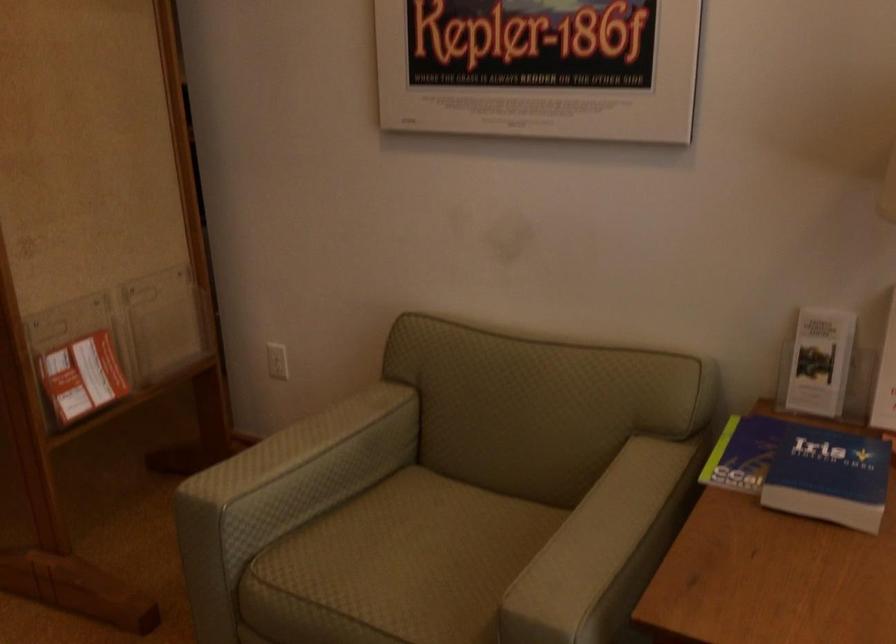
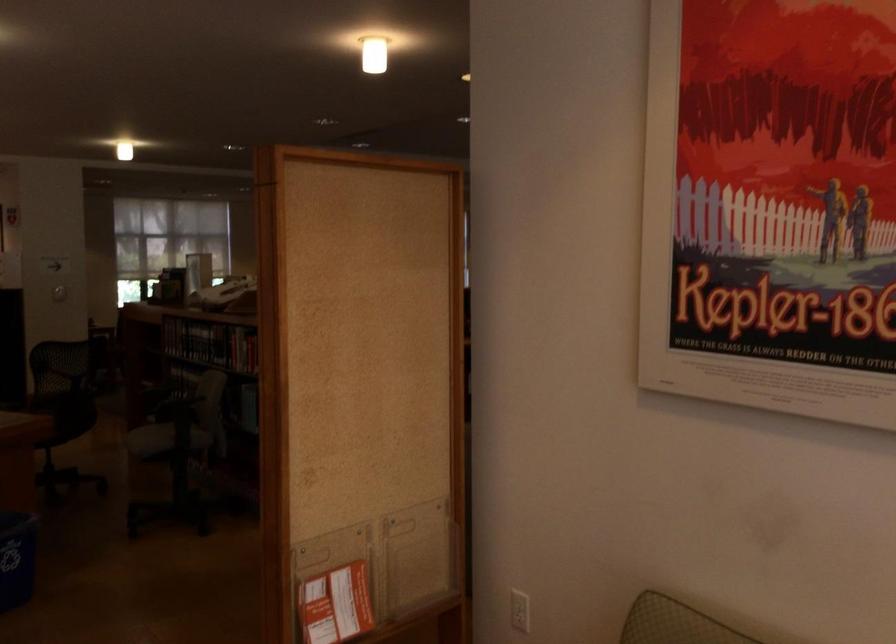
Question: The camera is either moving clockwise (left) or counter-clockwise (right) around the object. The first image is from the beginning of the video and the second image is from the end. Is the camera moving left or right when shooting the video?

Choices:
 (A) Left
 (B) Right

Answer: (B)